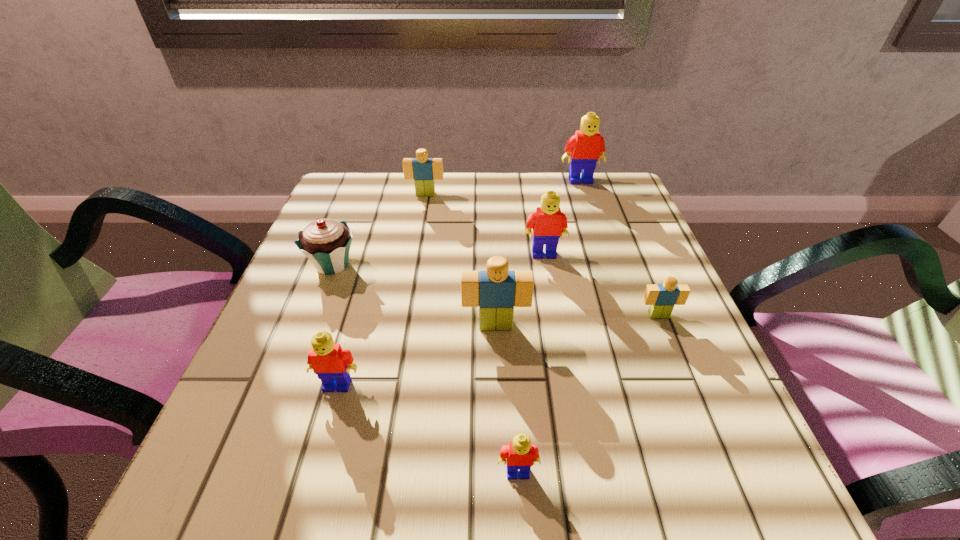
The width and height of the screenshot is (960, 540). I want to click on the smallest beige Lego, so click(x=662, y=298).

Find the location of `the third yellow Lego from right to left`. the third yellow Lego from right to left is located at coordinates (520, 454).

Identify the location of the nearest Lego. (520, 454).

Where is `free location located on the front-facing side of the biggest yellow Lego`? free location located on the front-facing side of the biggest yellow Lego is located at coordinates (612, 277).

Identify the location of vacant space situated on the face of the second beige Lego from right to left. (501, 490).

I want to click on vacant space positioned on the front-facing side of the fifth Lego from left to right, so click(564, 374).

At what (x,y) coordinates should I click in order to perform the action: click on free spot located on the face of the second farthest Lego. Please return your answer as a coordinate pair (x, y). This screenshot has height=540, width=960. Looking at the image, I should click on (422, 215).

Where is `vacant space located 0.110m on the front-facing side of the second nearest Lego`? The height and width of the screenshot is (540, 960). vacant space located 0.110m on the front-facing side of the second nearest Lego is located at coordinates (316, 462).

I want to click on free location located 0.300m on the right of the cupcake, so click(x=505, y=265).

Where is `vacant space located on the face of the rightmost beige Lego`? Image resolution: width=960 pixels, height=540 pixels. vacant space located on the face of the rightmost beige Lego is located at coordinates (699, 414).